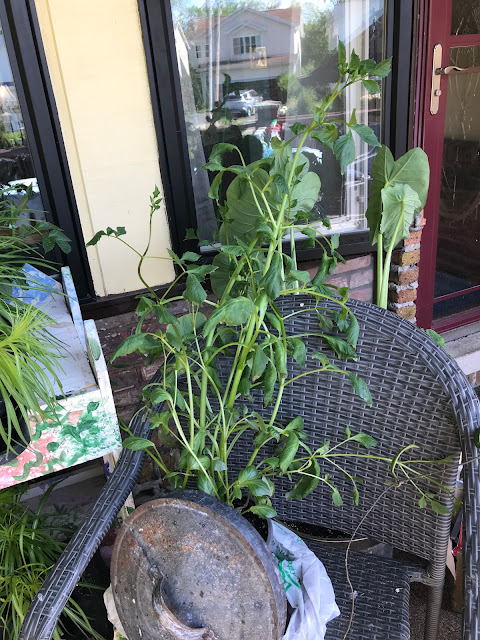
Identify the location of table. (85, 404).